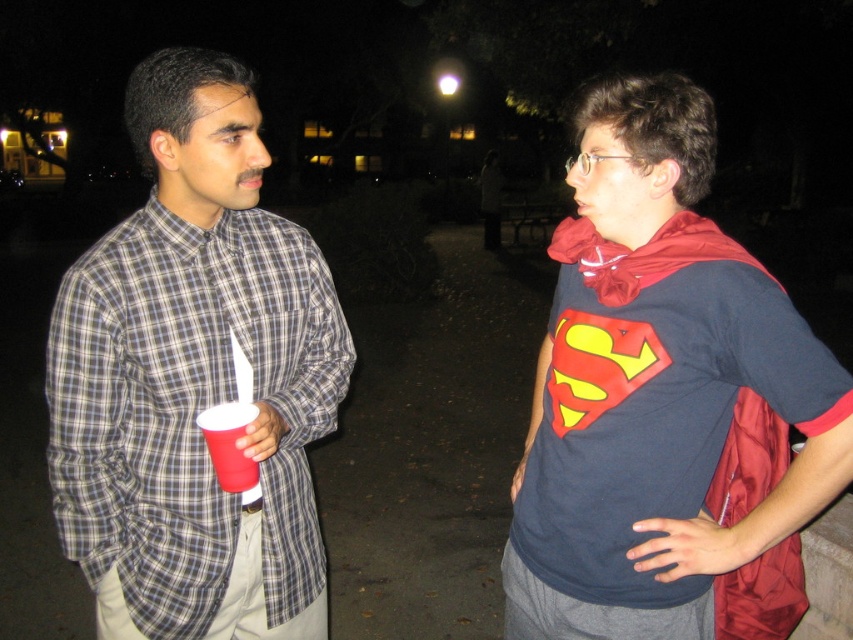
You are at a party and need to decide whether to wear a plaid shirt at center or carry a matte plastic cup at left. Based on their sizes, which one takes up more space?

The plaid shirt at center has a larger width than the matte plastic cup at left, so the plaid shirt at center takes up more space.

From the picture: You are at a costume party and need to grab your drink quickly. You see the red fabric cape at center and the matte plastic cup at left. Which object is easier to reach if you are standing directly in front of them?

The red fabric cape at center is closer to the viewer than the matte plastic cup at left, so it is easier to reach.